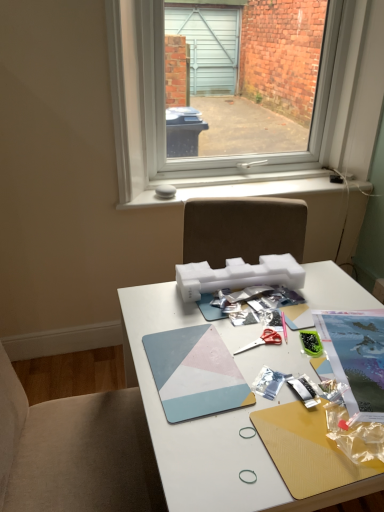
Find the location of a particular element. The image size is (384, 512). blank space situated above geometric matte mousepad at center, acting as the 2th magazine starting from the right (from a real-world perspective) is located at coordinates (188, 365).